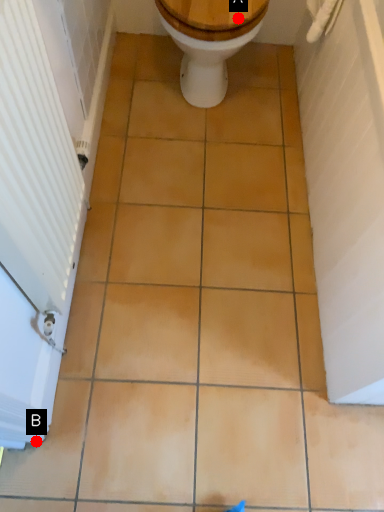
Question: Two points are circled on the image, labeled by A and B beside each circle. Which point is farther to the camera?

Choices:
 (A) A is further
 (B) B is further

Answer: (A)